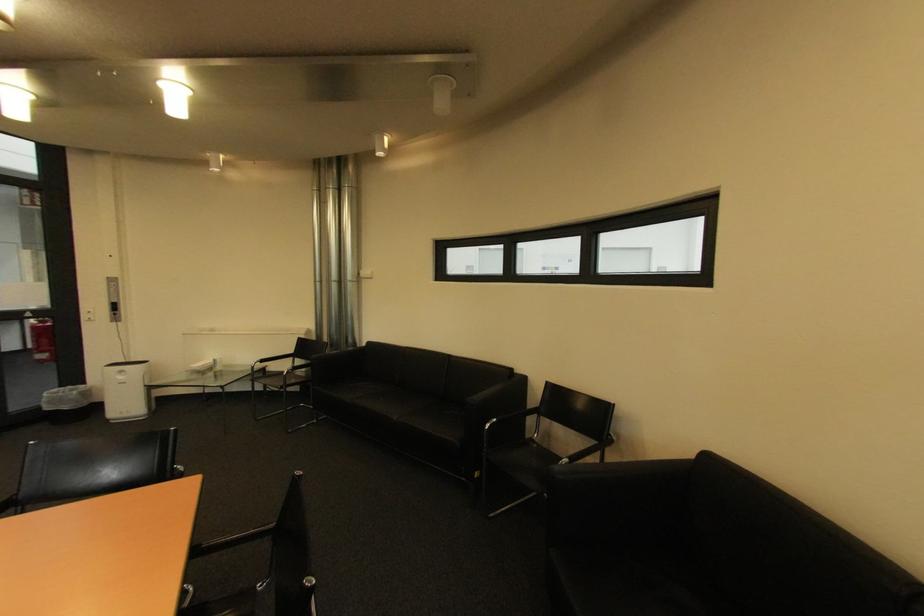
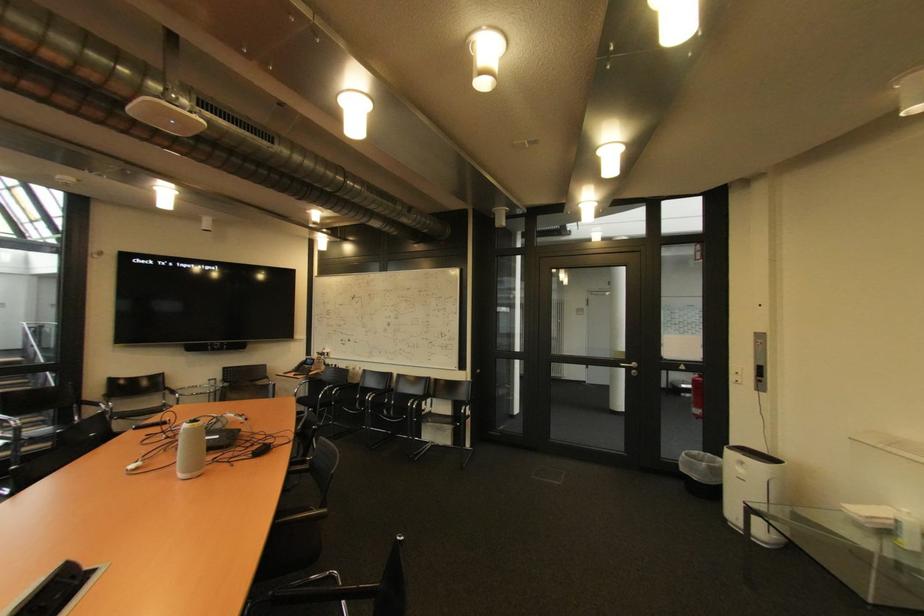
The point at (129, 379) is marked in the first image. Where is the corresponding point in the second image?

(748, 471)